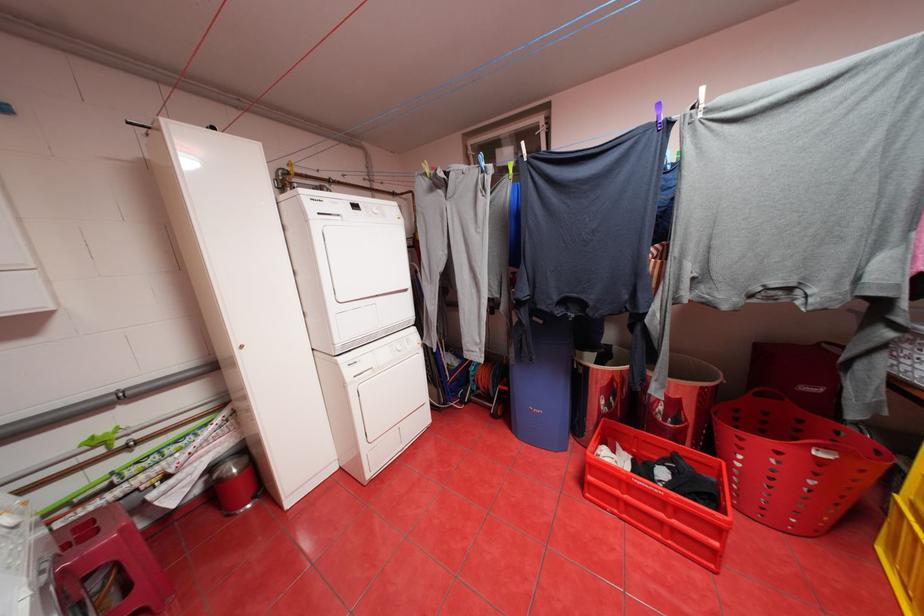
Find the location of a particular element. The width and height of the screenshot is (924, 616). dryer control knob is located at coordinates (378, 211).